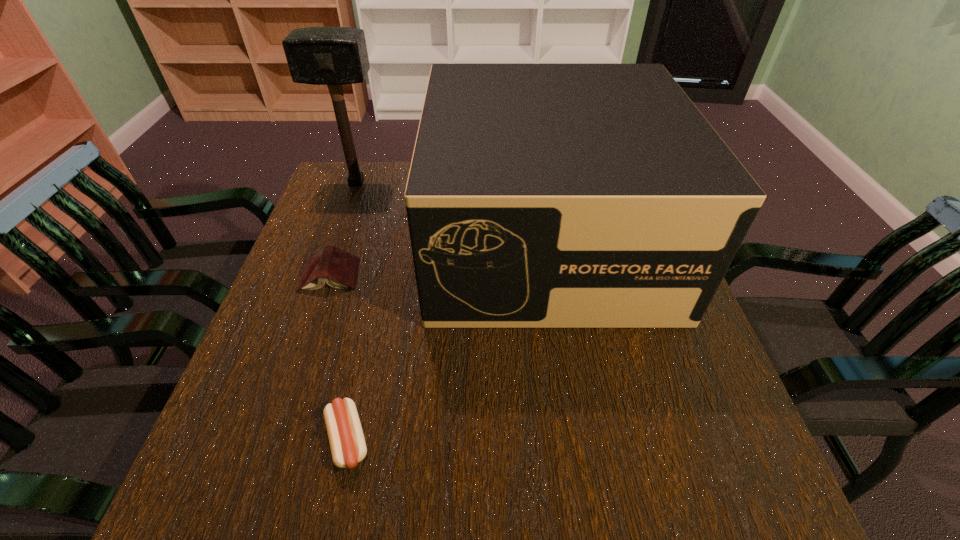
Identify which object is located as the third nearest to the book. Please provide its 2D coordinates. Your answer should be formatted as a tuple, i.e. [(x, y)], where the tuple contains the x and y coordinates of a point satisfying the conditions above.

[(347, 443)]

Locate an element on the screen. object identified as the third closest to the box is located at coordinates (347, 443).